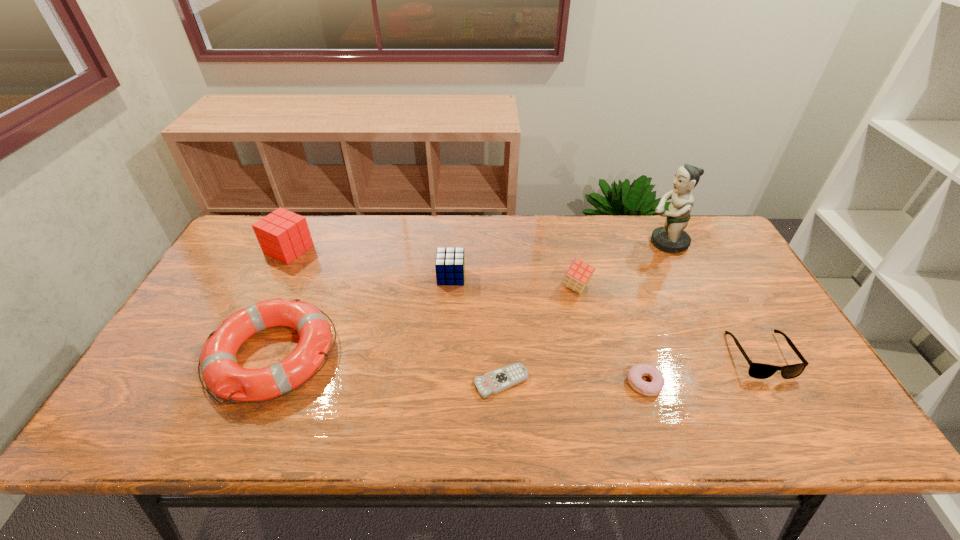
Locate an element on the screen. the tallest object is located at coordinates (672, 238).

You are a GUI agent. You are given a task and a screenshot of the screen. Output one action in this format:
    pyautogui.click(x=<x>, y=<y>)
    Task: Click on the second tallest object
    This screenshot has height=540, width=960.
    Given the screenshot: What is the action you would take?
    pyautogui.click(x=283, y=235)

The height and width of the screenshot is (540, 960). Find the location of `the tallest cube`. the tallest cube is located at coordinates pyautogui.click(x=283, y=235).

The height and width of the screenshot is (540, 960). Identify the location of the fifth object from left to right. (579, 273).

Image resolution: width=960 pixels, height=540 pixels. I want to click on the second cube from right to left, so click(450, 262).

Where is `life buoy`? The height and width of the screenshot is (540, 960). life buoy is located at coordinates (221, 373).

The width and height of the screenshot is (960, 540). I want to click on the third shortest object, so click(756, 370).

Identify the location of the sixth object from left to right. The height and width of the screenshot is (540, 960). (652, 388).

The height and width of the screenshot is (540, 960). What are the coordinates of `the seventh tallest object` in the screenshot? It's located at (652, 388).

At what (x,y) coordinates should I click in order to perform the action: click on remote control. Please return your answer as a coordinate pair (x, y). Looking at the image, I should click on (493, 382).